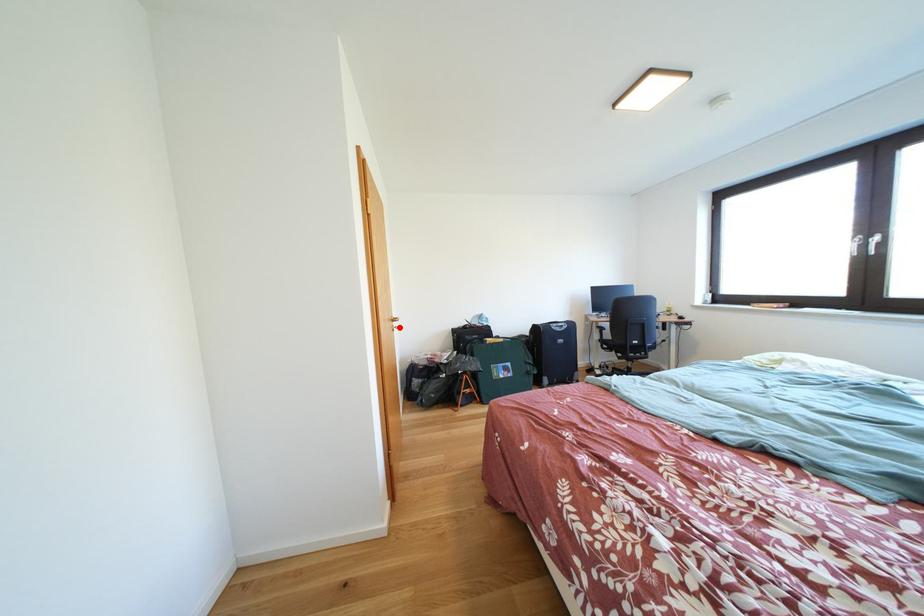
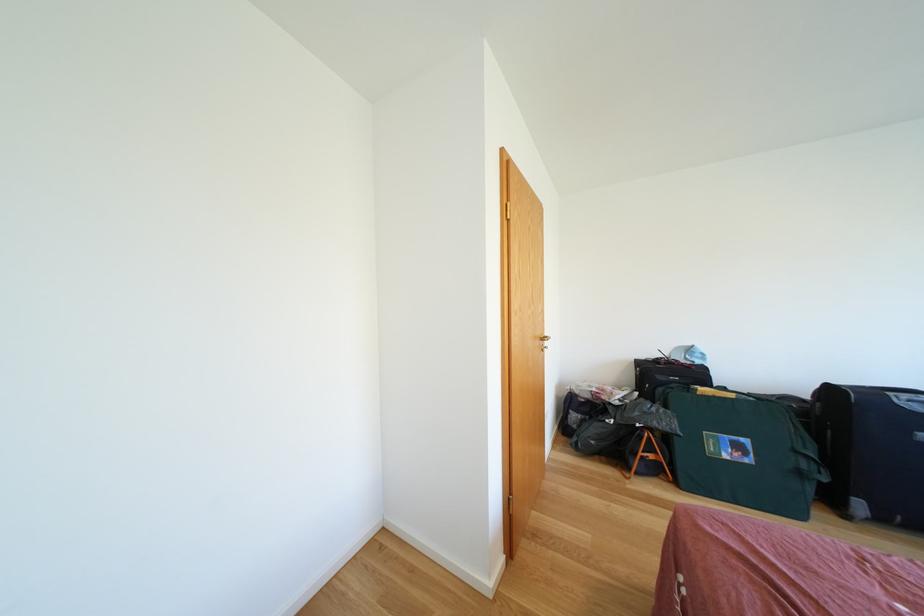
Question: I am providing you with two images of the same scene from different viewpoints. In image1, a red point is highlighted. Considering the same 3D point in image2, which of the following is correct?

Choices:
 (A) It is closer
 (B) It is farther

Answer: (B)